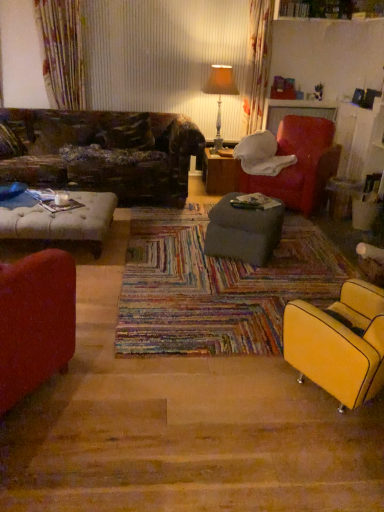
Image resolution: width=384 pixels, height=512 pixels. What are the coordinates of `free spot in front of matte yellow armchair at lower right, which ranks as the first chair in front-to-back order` in the screenshot? It's located at 328,443.